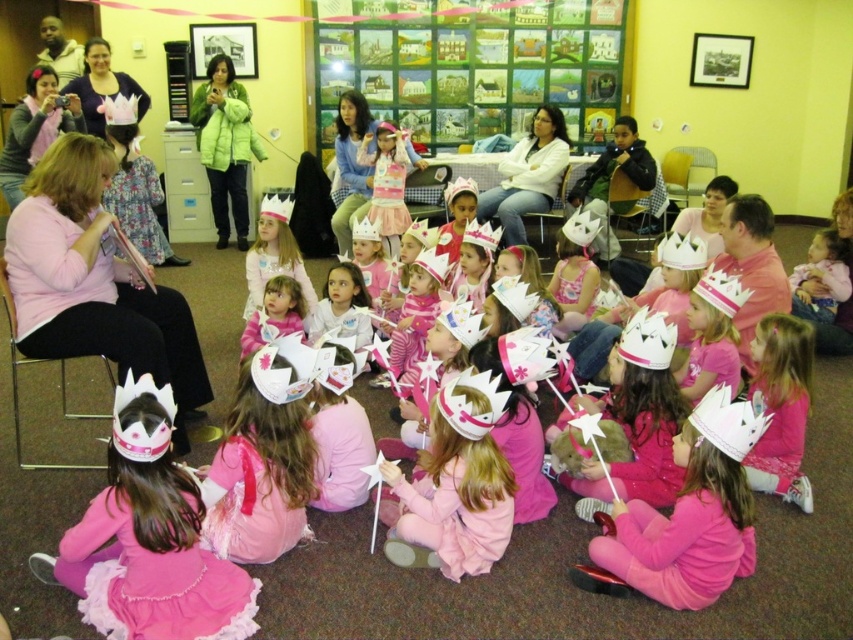
Question: Which of the following is the farthest from the observer?

Choices:
 (A) green matte bulletin board at upper center
 (B) matte pink fabric dress at lower left
 (C) matte white crown at upper left

Answer: (A)

Question: Which point is farther from the camera taking this photo?

Choices:
 (A) (137, 113)
 (B) (498, 461)
 (C) (373, 179)
 (D) (656, 509)

Answer: (A)

Question: Can you confirm if matte pink crown at lower right is thinner than matte pink crown at upper left?

Choices:
 (A) yes
 (B) no

Answer: (A)

Question: Among these points, which one is nearest to the camera?

Choices:
 (A) (439, 90)
 (B) (154, 614)
 (C) (369, 138)
 (D) (503, 544)

Answer: (B)

Question: Observing the image, what is the correct spatial positioning of matte pink crown at lower right in reference to pink satin dress at center?

Choices:
 (A) above
 (B) below

Answer: (B)

Question: Is the position of matte pink crown at upper left more distant than that of matte white crown at upper left?

Choices:
 (A) no
 (B) yes

Answer: (A)